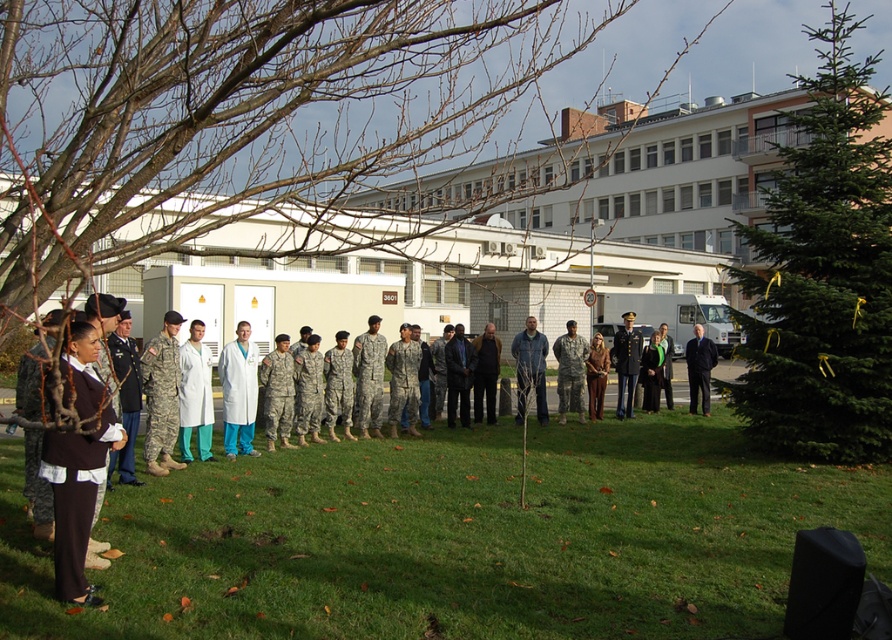
Question: Does white lab coat at center appear on the right side of brown leather jacket at center?

Choices:
 (A) no
 (B) yes

Answer: (A)

Question: Which point appears farthest from the camera in this image?

Choices:
 (A) (252, 348)
 (B) (691, 365)

Answer: (B)

Question: Which of the following is the closest to the observer?

Choices:
 (A) brown wool sweater at lower left
 (B) green grass at center
 (C) camouflage uniform at center
 (D) bare branches at left

Answer: (D)

Question: Considering the relative positions of green grass at center and dark blue fabric suit at center in the image provided, where is green grass at center located with respect to dark blue fabric suit at center?

Choices:
 (A) left
 (B) right

Answer: (A)

Question: Does brown wool sweater at lower left appear on the left side of dark blue fabric suit at center?

Choices:
 (A) no
 (B) yes

Answer: (B)

Question: Which of the following is the farthest from the observer?

Choices:
 (A) white matte coat at center
 (B) green grass at center
 (C) bare branches at left
 (D) camouflage uniform at center

Answer: (D)